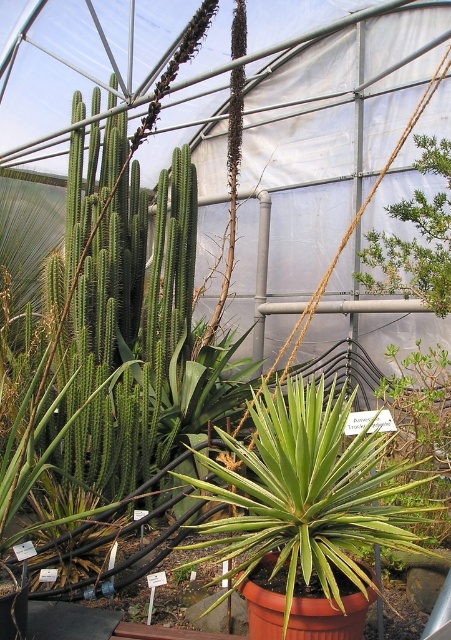
Is point (304, 451) more distant than point (403, 262)?

No, (304, 451) is in front of (403, 262).

Is green leafy plant at center smaller than green leafy shrub at upper right?

Incorrect, green leafy plant at center is not smaller in size than green leafy shrub at upper right.

Is point (261, 452) positioned before point (377, 260)?

Yes, it is in front of point (377, 260).

Where is `green leafy plant at center`? green leafy plant at center is located at coordinates (307, 493).